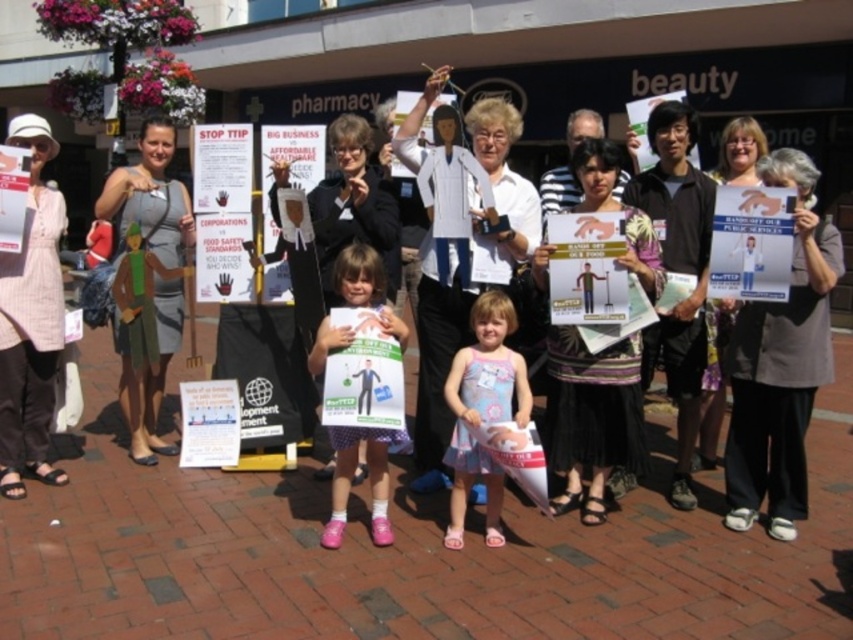
Who is taller, light pink woven dress at left or white paper doll at center?

white paper doll at center is taller.

Does light pink woven dress at left have a greater height compared to white paper doll at center?

Answer: In fact, light pink woven dress at left may be shorter than white paper doll at center.

You are a GUI agent. You are given a task and a screenshot of the screen. Output one action in this format:
    pyautogui.click(x=<x>, y=<y>)
    Task: Click on the light pink woven dress at left
    
    Given the screenshot: What is the action you would take?
    pyautogui.click(x=30, y=321)

Can you confirm if gray fabric jacket at center is bigger than pink fabric dress at center?

Correct, gray fabric jacket at center is larger in size than pink fabric dress at center.

The width and height of the screenshot is (853, 640). Describe the element at coordinates (780, 364) in the screenshot. I see `gray fabric jacket at center` at that location.

The height and width of the screenshot is (640, 853). Identify the location of gray fabric jacket at center. (780, 364).

This screenshot has height=640, width=853. What are the coordinates of `gray fabric jacket at center` in the screenshot? It's located at (780, 364).

Is point (433, 84) positioned after point (463, 374)?

Yes, it is.

Find the location of `white paper doll at center`. white paper doll at center is located at coordinates (x=436, y=353).